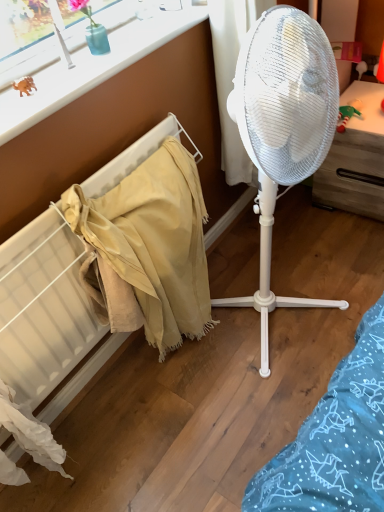
The image size is (384, 512). Find the location of `vacant space underneath white plastic fan at center (from a real-world perspective)`. vacant space underneath white plastic fan at center (from a real-world perspective) is located at coordinates (288, 315).